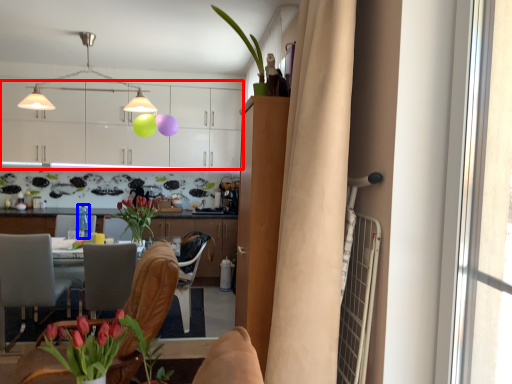
Question: Which point is further to the camera, cabinetry (highlighted by a red box) or bottle (highlighted by a blue box)?

Choices:
 (A) cabinetry
 (B) bottle

Answer: (A)